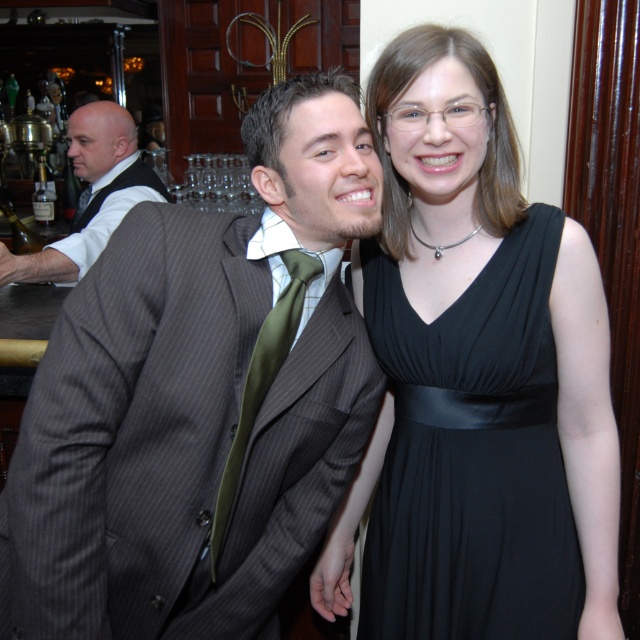
Question: Is black satin dress at center to the right of white shirt at left from the viewer's perspective?

Choices:
 (A) yes
 (B) no

Answer: (A)

Question: Can you confirm if black satin dress at center is positioned to the right of white shirt at left?

Choices:
 (A) yes
 (B) no

Answer: (A)

Question: Which object appears closest to the camera in this image?

Choices:
 (A) white shirt at left
 (B) black satin dress at center
 (C) dark gray pinstripe suit at center
 (D) green silk tie at center

Answer: (C)

Question: Which point is farther to the camera?

Choices:
 (A) (96, 141)
 (B) (253, 376)

Answer: (A)

Question: Which of these objects is positioned farthest from the black satin dress at center?

Choices:
 (A) green silk tie at center
 (B) white shirt at left

Answer: (B)

Question: Is black satin dress at center positioned before white shirt at left?

Choices:
 (A) yes
 (B) no

Answer: (A)